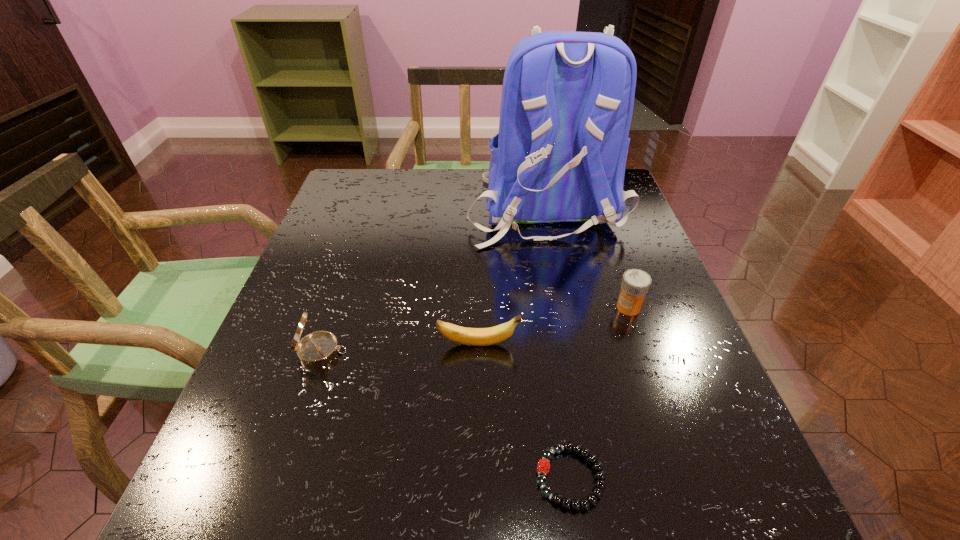
Image resolution: width=960 pixels, height=540 pixels. What are the coordinates of `the farthest object` in the screenshot? It's located at (567, 100).

Where is `the tallest object`? The image size is (960, 540). the tallest object is located at coordinates (567, 100).

Image resolution: width=960 pixels, height=540 pixels. Find the location of `the leftmost object`. the leftmost object is located at coordinates (319, 348).

What are the coordinates of `the fourth nearest object` in the screenshot? It's located at (x=635, y=284).

Find the location of a particular element. Image resolution: width=960 pixels, height=540 pixels. banana is located at coordinates pyautogui.click(x=469, y=336).

You are a GUI agent. You are given a task and a screenshot of the screen. Output one action in this format:
    pyautogui.click(x=<x>, y=<y>)
    Task: Click on the shortest object
    
    Given the screenshot: What is the action you would take?
    pyautogui.click(x=543, y=466)

Identify the location of bracelet. (543, 466).

At what (x,y) coordinates should I click in order to perform the action: click on free space located 0.090m on the back of the farthest object. Please return your answer as a coordinate pair (x, y). Image resolution: width=960 pixels, height=540 pixels. Looking at the image, I should click on (559, 277).

Find the location of a particular element. The image size is (960, 540). blank space located with the dial facing the compass is located at coordinates (422, 352).

This screenshot has width=960, height=540. Identify the location of free location located 0.070m on the label side of the medicine. (581, 307).